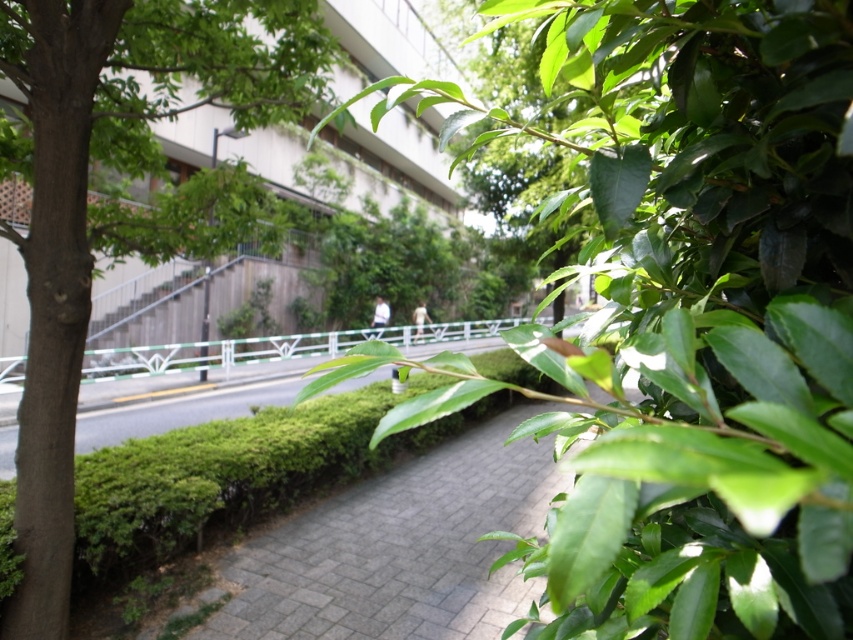
You are standing in the urban scene and want to take a photo of the green leafy tree at center. If your camera can focus on objects up to 16 inches away, will it be able to capture the tree clearly?

The green leafy tree at center is 15.55 inches away from the camera, which is within the camera focus range of up to 16 inches. Therefore, the camera can capture the tree clearly.

Based on the photo, you are a gardener planning to water both the green leafy tree at center and the green leafy tree at left. Your water tank can hold enough water to cover 10 feet between two trees. Can you water both trees without needing to refill your tank?

The distance between the green leafy tree at center and the green leafy tree at left is 9.18 feet, which is less than the 10 feet capacity of your water tank. Therefore, you can water both trees without needing to refill your tank.